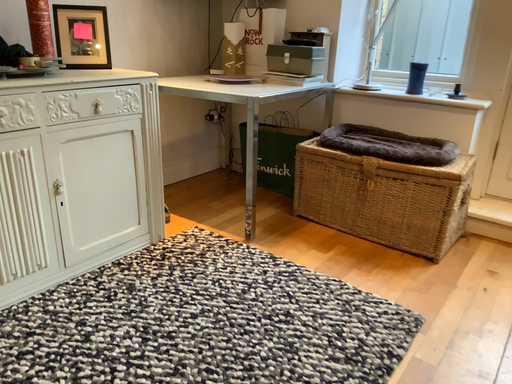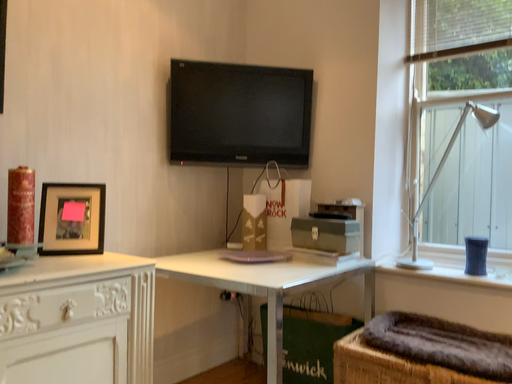
Question: Which way did the camera rotate in the video?

Choices:
 (A) rotated downward
 (B) rotated upward

Answer: (B)